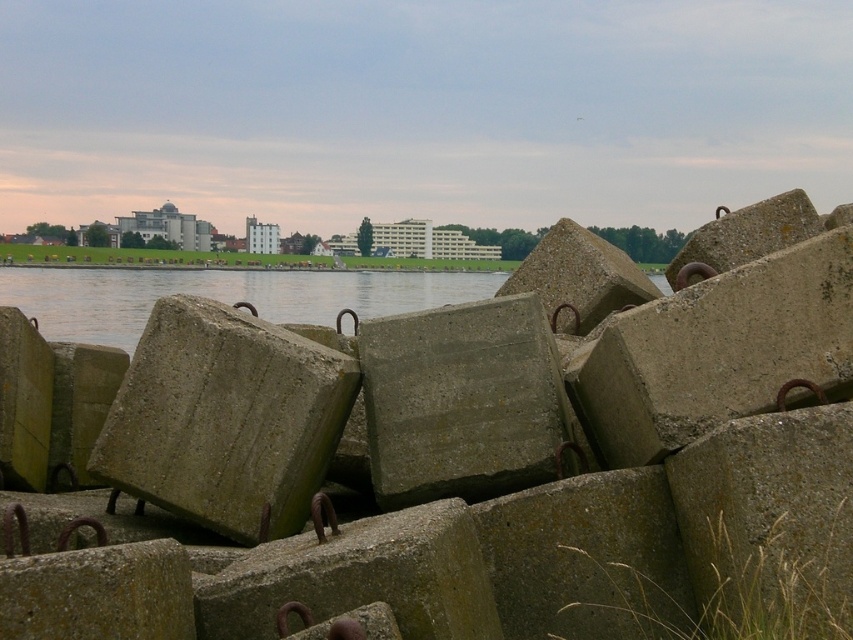
Question: Is gray concrete tetrapod at center bigger than green concrete tetrapod at center?

Choices:
 (A) no
 (B) yes

Answer: (B)

Question: Does gray concrete tetrapod at center lie in front of green concrete tetrapod at center?

Choices:
 (A) yes
 (B) no

Answer: (A)

Question: Is gray concrete tetrapod at center to the right of green concrete tetrapod at center from the viewer's perspective?

Choices:
 (A) no
 (B) yes

Answer: (B)

Question: Among these points, which one is farthest from the camera?

Choices:
 (A) (247, 452)
 (B) (701, 278)

Answer: (A)

Question: Among these objects, which one is nearest to the camera?

Choices:
 (A) green concrete tetrapod at center
 (B) gray concrete tetrapod at center

Answer: (B)